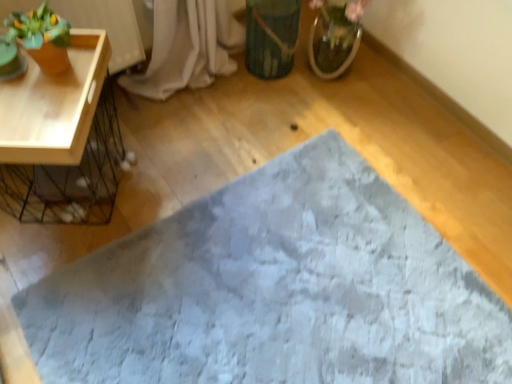
Where is `free space in front of green matte vase at center`? free space in front of green matte vase at center is located at coordinates (263, 112).